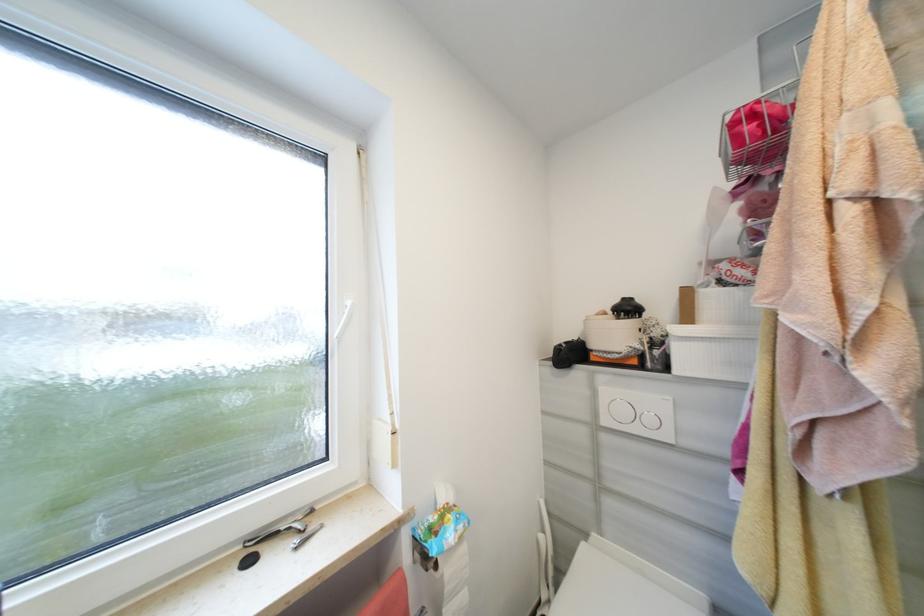
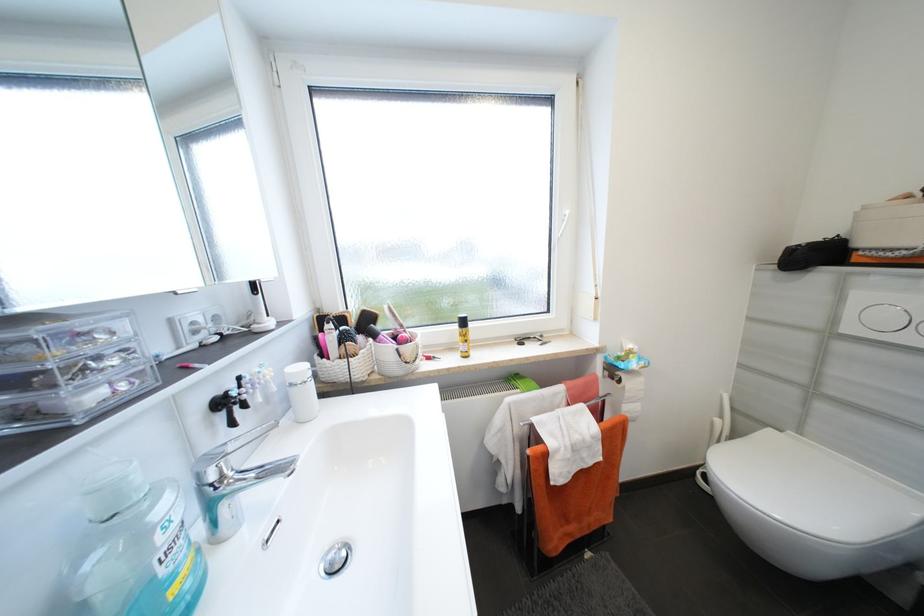
The images are taken continuously from a first-person perspective. In which direction is your viewpoint rotating?

The camera rotated toward left-down.